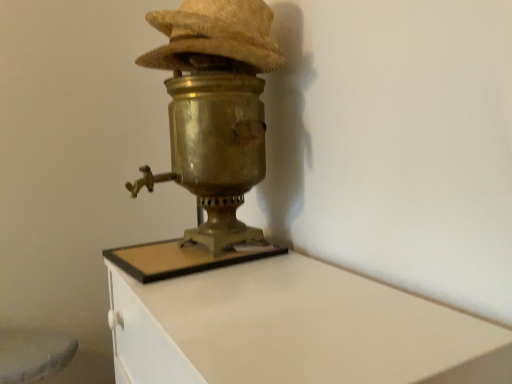
Question: From the image's perspective, is brass samovar at center located beneath woven straw hat at upper center?

Choices:
 (A) yes
 (B) no

Answer: (A)

Question: From a real-world perspective, is brass samovar at center physically above woven straw hat at upper center?

Choices:
 (A) yes
 (B) no

Answer: (B)

Question: Can you confirm if brass samovar at center is positioned to the right of woven straw hat at upper center?

Choices:
 (A) yes
 (B) no

Answer: (A)

Question: Is brass samovar at center closer to the viewer compared to woven straw hat at upper center?

Choices:
 (A) yes
 (B) no

Answer: (A)

Question: Is brass samovar at center smaller than woven straw hat at upper center?

Choices:
 (A) yes
 (B) no

Answer: (B)

Question: Considering the relative positions of woven straw hat at upper center and brass samovar at center in the image provided, is woven straw hat at upper center to the left or to the right of brass samovar at center?

Choices:
 (A) left
 (B) right

Answer: (A)

Question: Does point (184, 51) appear closer or farther from the camera than point (254, 268)?

Choices:
 (A) closer
 (B) farther

Answer: (B)

Question: From the image's perspective, is woven straw hat at upper center located above or below brass samovar at center?

Choices:
 (A) above
 (B) below

Answer: (A)

Question: Considering their positions, is woven straw hat at upper center located in front of or behind brass samovar at center?

Choices:
 (A) behind
 (B) front

Answer: (A)

Question: From a real-world perspective, is brass/bronze table lamp at center positioned above or below woven straw hat at upper center?

Choices:
 (A) above
 (B) below

Answer: (B)

Question: From their relative heights in the image, would you say brass/bronze table lamp at center is taller or shorter than woven straw hat at upper center?

Choices:
 (A) short
 (B) tall

Answer: (B)

Question: Visually, is brass/bronze table lamp at center positioned to the left or to the right of woven straw hat at upper center?

Choices:
 (A) right
 (B) left

Answer: (B)

Question: In terms of size, does brass/bronze table lamp at center appear bigger or smaller than woven straw hat at upper center?

Choices:
 (A) big
 (B) small

Answer: (A)

Question: Looking at the image, does brass/bronze table lamp at center seem bigger or smaller compared to brass samovar at center?

Choices:
 (A) big
 (B) small

Answer: (B)

Question: In the image, is brass/bronze table lamp at center on the left side or the right side of brass samovar at center?

Choices:
 (A) left
 (B) right

Answer: (A)